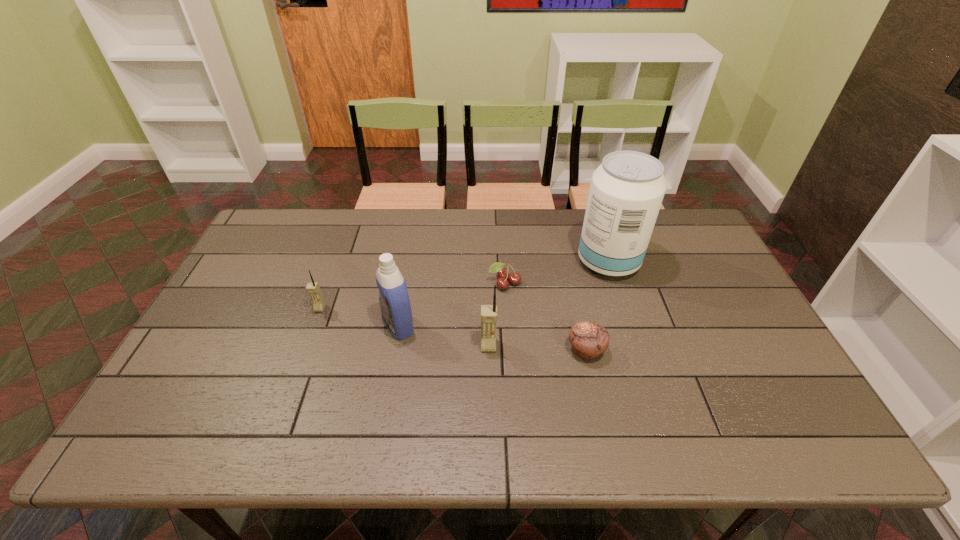
Locate an element on the screen. the left cellular telephone is located at coordinates (313, 288).

Where is `the third shortest object`? This screenshot has height=540, width=960. the third shortest object is located at coordinates (313, 288).

Locate an element on the screen. The image size is (960, 540). the taller cellular telephone is located at coordinates coord(488,312).

You are a GUI agent. You are given a task and a screenshot of the screen. Output one action in this format:
    pyautogui.click(x=<x>, y=<y>)
    Task: Click on the right cellular telephone
    
    Given the screenshot: What is the action you would take?
    pyautogui.click(x=488, y=312)

The image size is (960, 540). I want to click on alcohol, so click(x=626, y=192).

Identify the location of detergent. This screenshot has height=540, width=960. coord(394,301).

What are the coordinates of `cherry` in the screenshot? It's located at (514, 278).

Locate an element on the screen. The width and height of the screenshot is (960, 540). muffin is located at coordinates (589, 339).

The image size is (960, 540). Identify the location of vacant space located 0.070m on the front of the leftmost object, where the keypad is located. (311, 332).

Identify the location of vacant space located 0.150m on the front of the nearer cellular telephone, where the keypad is located. The height and width of the screenshot is (540, 960). (490, 404).